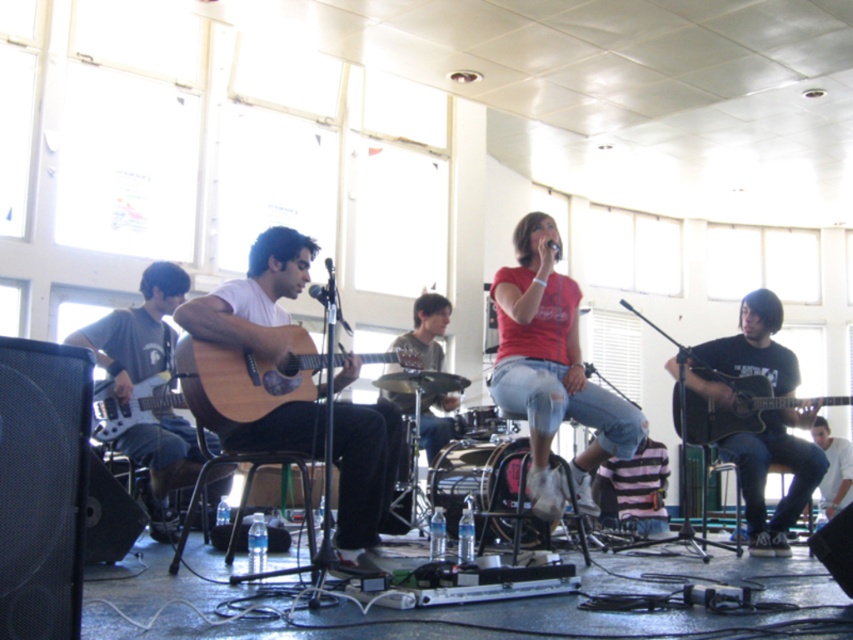
Which is behind, point (218, 301) or point (833, 474)?

The point (833, 474) is behind.

Who is more distant from viewer, (212, 337) or (846, 474)?

Point (846, 474)

Locate an element on the screen. Image resolution: width=853 pixels, height=640 pixels. matte light brown acoustic guitar at center is located at coordinates (254, 298).

Which is below, natural wood acoustic guitar at center or matte black acoustic guitar at right?

matte black acoustic guitar at right

Is point (222, 362) less distant than point (775, 408)?

That is True.

Which is behind, point (248, 419) or point (756, 426)?

Point (756, 426)

At what (x,y) coordinates should I click in order to perform the action: click on natural wood acoustic guitar at center. Please return your answer as a coordinate pair (x, y). This screenshot has height=640, width=853. Looking at the image, I should click on (244, 378).

Measure the distance between point (502, 307) and camera.

A distance of 13.77 feet exists between point (502, 307) and camera.

Which is behind, point (608, 400) or point (698, 428)?

Point (698, 428)

Does point (521, 291) come in front of point (737, 432)?

Yes, it is.

This screenshot has height=640, width=853. Find the location of `red matte shirt at center`. red matte shirt at center is located at coordinates (550, 368).